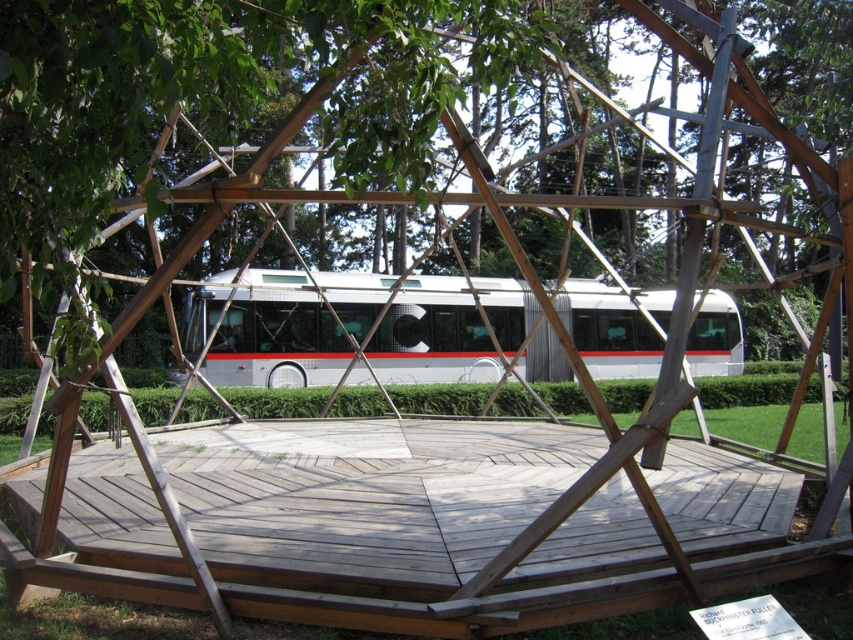
Question: Can you confirm if green leafy tree at center is smaller than white metallic bus at center?

Choices:
 (A) yes
 (B) no

Answer: (A)

Question: Which point is closer to the camera?

Choices:
 (A) green leafy tree at center
 (B) white metallic bus at center

Answer: (A)

Question: Is green leafy tree at center bigger than white metallic bus at center?

Choices:
 (A) no
 (B) yes

Answer: (A)

Question: Does green leafy tree at center have a lesser width compared to white metallic bus at center?

Choices:
 (A) yes
 (B) no

Answer: (A)